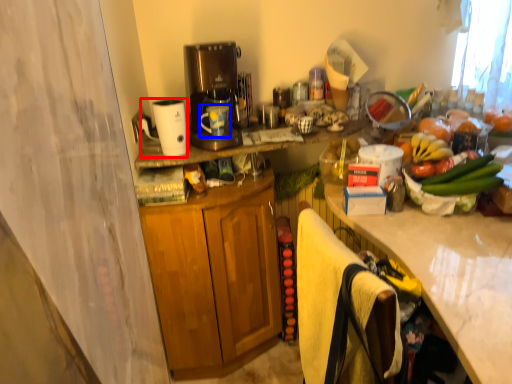
Question: Which object appears farthest to the camera in this image, appliance (highlighted by a red box) or mug (highlighted by a blue box)?

Choices:
 (A) appliance
 (B) mug

Answer: (B)